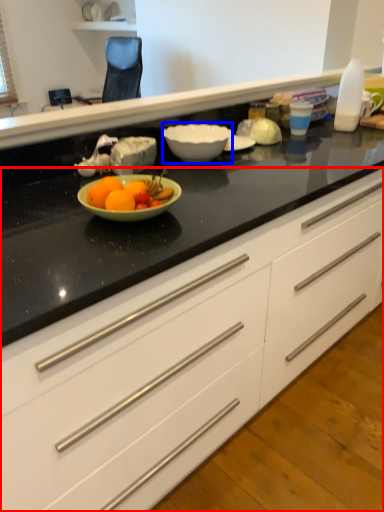
Question: Which point is closer to the camera, cabinetry (highlighted by a red box) or bowl (highlighted by a blue box)?

Choices:
 (A) cabinetry
 (B) bowl

Answer: (A)